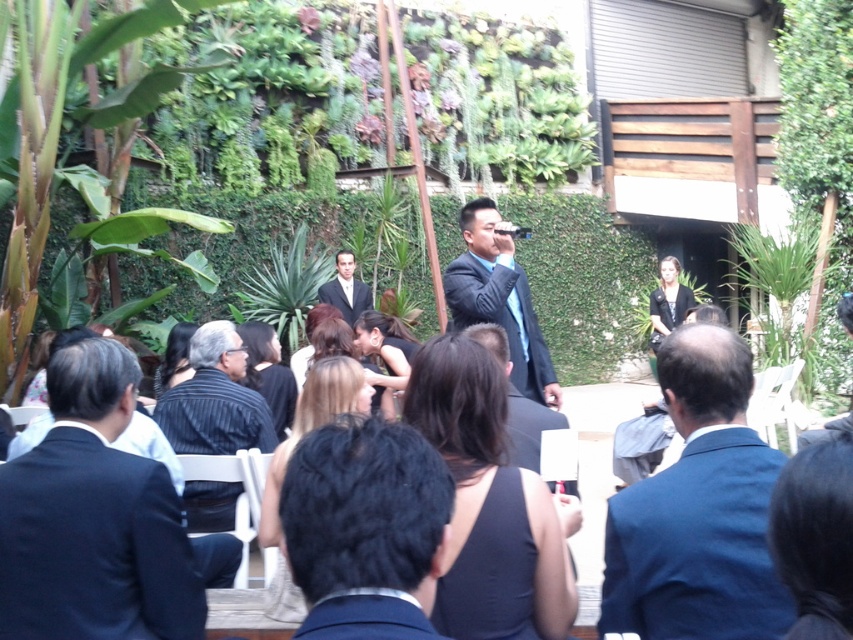
Question: Does blue suit at center appear over green leafy plant at right?

Choices:
 (A) yes
 (B) no

Answer: (B)

Question: Which point is farther to the camera?

Choices:
 (A) shiny black suit at center
 (B) dark blue suit at center
 (C) black fabric dress at center

Answer: (C)

Question: Is black suit at left further to camera compared to green leafy plant at right?

Choices:
 (A) yes
 (B) no

Answer: (B)

Question: Can you confirm if black suit at left is positioned below black fabric dress at center?

Choices:
 (A) yes
 (B) no

Answer: (A)

Question: Which object appears closest to the camera in this image?

Choices:
 (A) navy blue fabric business suit at center
 (B) black suit at center
 (C) shiny black suit at center

Answer: (B)

Question: Which of the following is the farthest from the observer?

Choices:
 (A) green leafy plant at right
 (B) green leafy plant at center
 (C) black suit at center
 (D) black fabric dress at center

Answer: (D)